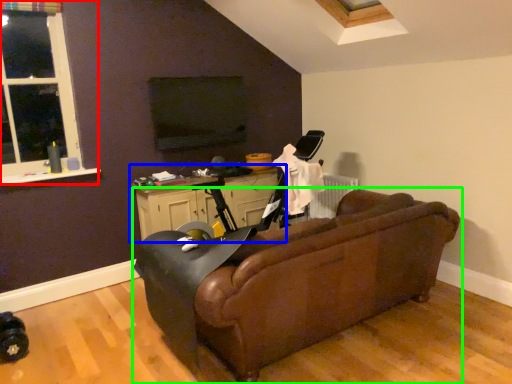
Question: Which object is positioned farthest from window (highlighted by a red box)? Select from table (highlighted by a blue box) and studio couch (highlighted by a green box).

Choices:
 (A) table
 (B) studio couch

Answer: (B)